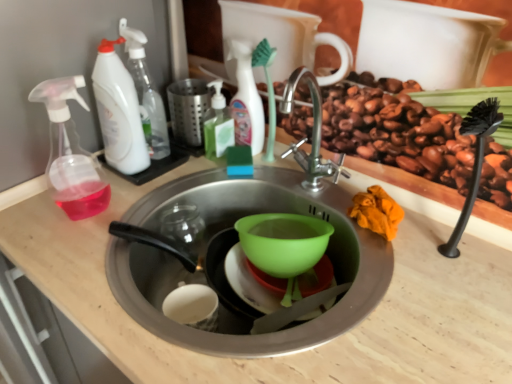
The height and width of the screenshot is (384, 512). Identify the location of vacant space in between transparent plastic spray bottle at left and white plastic spray bottle at upper left, which appears as the 4th cleaning product when viewed from the right. (112, 185).